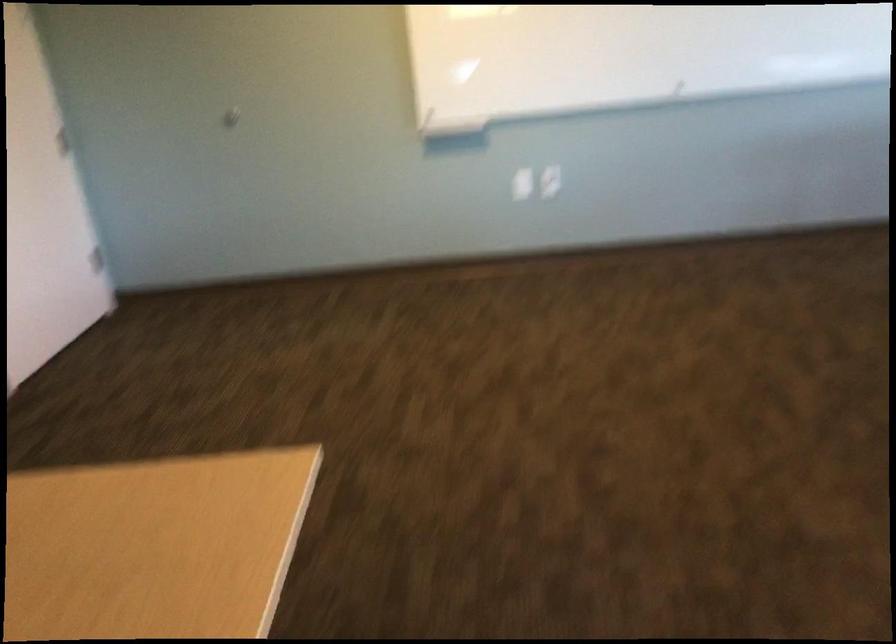
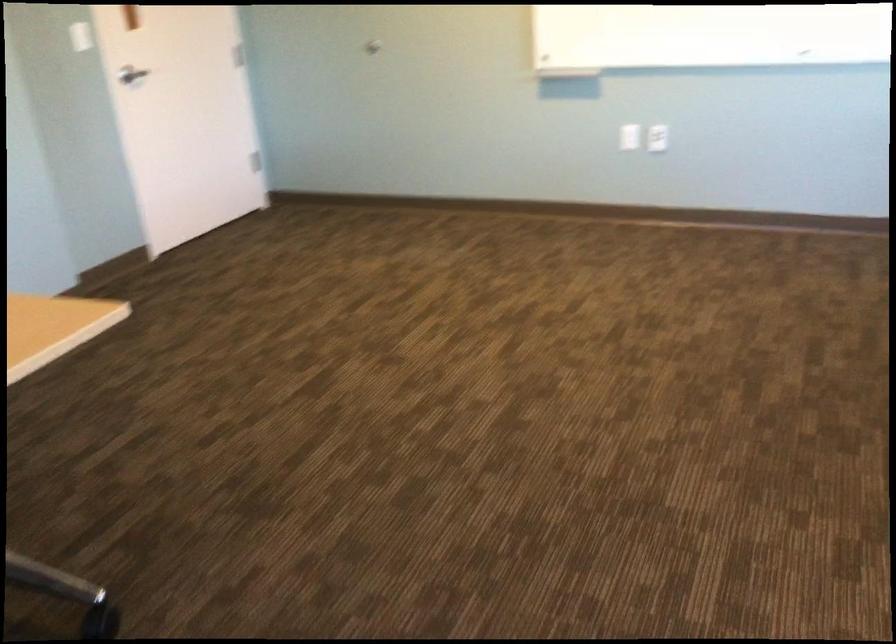
The point at (522, 189) is marked in the first image. Where is the corresponding point in the second image?

(629, 137)